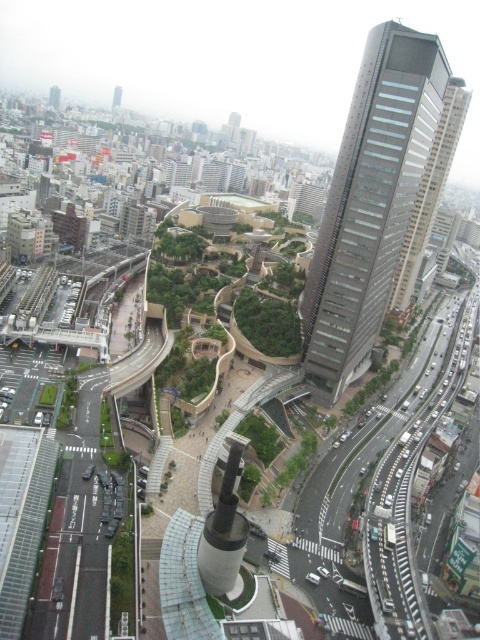
Looking at this image, you are a drone operator trying to deliver a package to the gray glass skyscraper at right. Your current position is at point (371, 200). Is the gray glass skyscraper at right located at your current position?

Yes, the gray glass skyscraper at right is located at point (371, 200), so the skyscraper is exactly at your current position.

You are standing at the base of the skyscraper and want to reach a specific point marked at coordinates point (408, 65). Given that the distance from your current position to this point is 145.80 meters, can you estimate how far you need to walk to reach it?

The distance from your current position to point (408, 65) is 145.80 meters, so you need to walk approximately 145.80 meters to reach it.